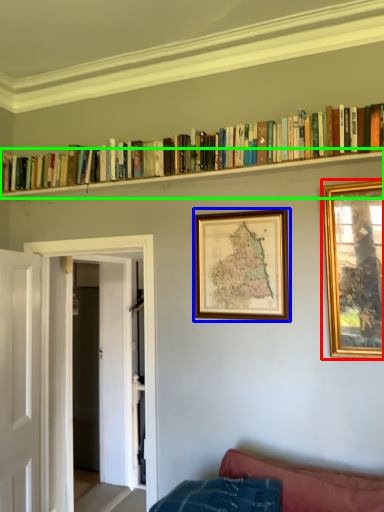
Question: Based on their relative distances, which object is farther from picture frame (highlighted by a red box)? Choose from picture frame (highlighted by a blue box) and shelf (highlighted by a green box).

Choices:
 (A) picture frame
 (B) shelf

Answer: (B)